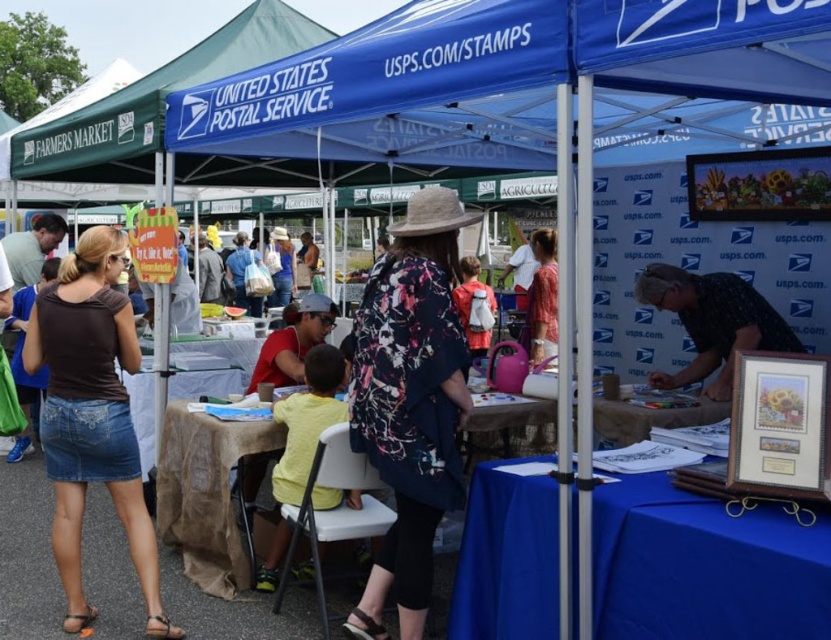
Which is more to the right, blue fabric table at lower right or brown denim skirt at lower left?

blue fabric table at lower right is more to the right.

Who is more distant from viewer, (672, 637) or (86, 369)?

Positioned behind is point (86, 369).

The width and height of the screenshot is (831, 640). I want to click on blue fabric table at lower right, so click(704, 566).

Identify the location of blue fabric table at lower right. (704, 566).

Is brown denim skirt at lower left shorter than brown burlap table at center?

No, brown denim skirt at lower left is not shorter than brown burlap table at center.

Measure the distance between brown denim skirt at lower left and brown burlap table at center.

brown denim skirt at lower left is 23.93 inches from brown burlap table at center.

I want to click on brown denim skirt at lower left, so click(x=92, y=417).

Find the location of `brown denim skirt at lower left`. brown denim skirt at lower left is located at coordinates (92, 417).

From the picture: Between floral-patterned shirt at center and brown burlap table at center, which one appears on the right side from the viewer's perspective?

Positioned to the right is floral-patterned shirt at center.

Can you confirm if floral-patterned shirt at center is taller than brown burlap table at center?

Yes.

Locate an element on the screen. This screenshot has width=831, height=640. floral-patterned shirt at center is located at coordinates (411, 403).